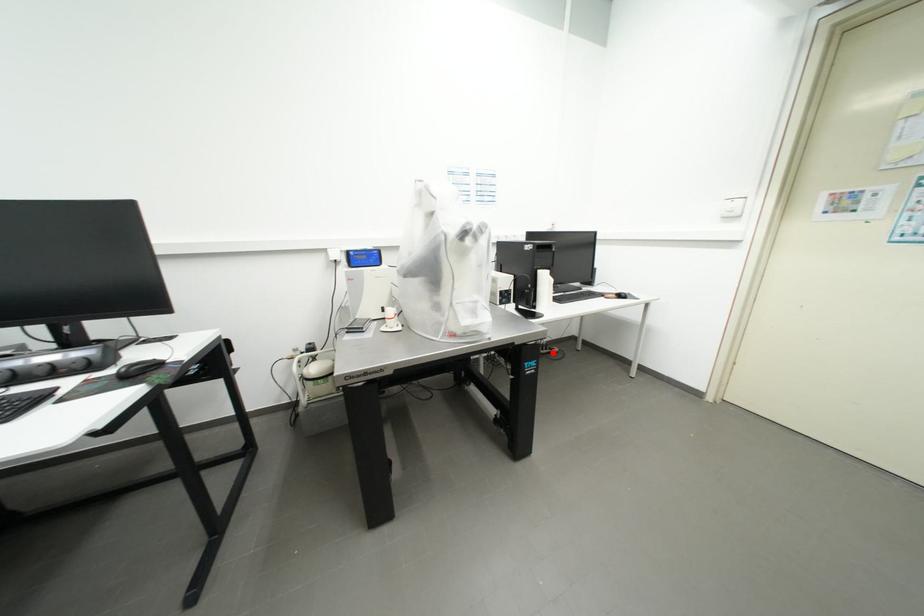
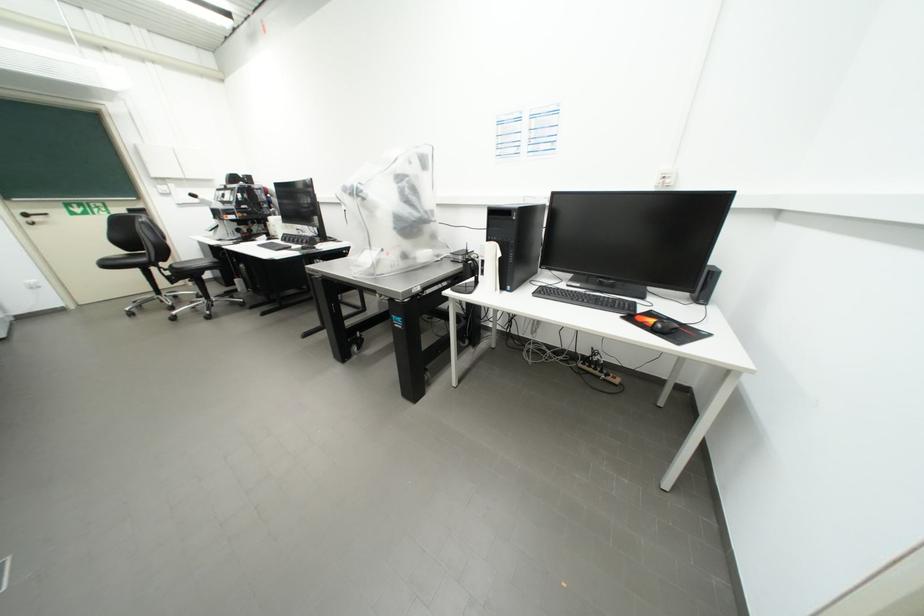
The point at the highlighted location is marked in the first image. Where is the corresponding point in the second image?

(603, 374)